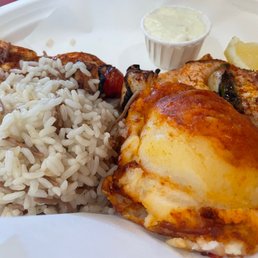
Find the location of a particular element. This screenshot has width=258, height=258. white plate is located at coordinates click(50, 237).